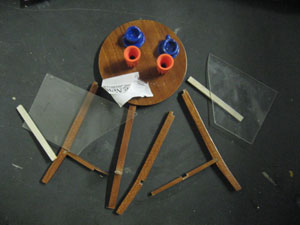
Locate an element on the screen. The height and width of the screenshot is (225, 300). right orange cup is located at coordinates (164, 67).